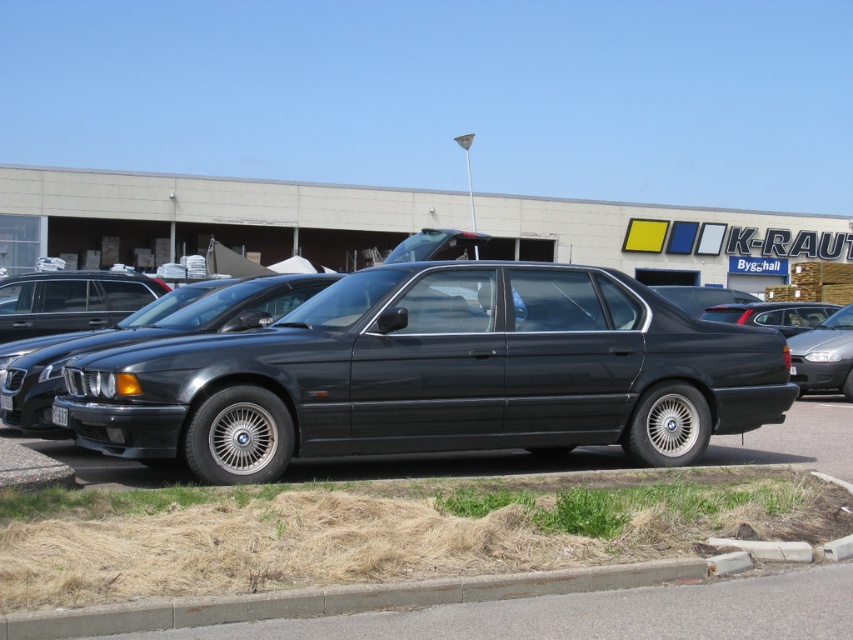
Question: Is gray concrete curb at lower center wider than white plastic license plate at center?

Choices:
 (A) yes
 (B) no

Answer: (A)

Question: Among these points, which one is farthest from the camera?

Choices:
 (A) (735, 312)
 (B) (61, 408)
 (C) (35, 561)

Answer: (A)

Question: Where is glossy black sedan at center located in relation to gray concrete curb at lower center in the image?

Choices:
 (A) above
 (B) below

Answer: (A)

Question: Can you confirm if matte black car at right is smaller than white plastic license plate at center?

Choices:
 (A) no
 (B) yes

Answer: (A)

Question: Which point is farther to the camera?

Choices:
 (A) (483, 596)
 (B) (62, 419)
 (C) (97, 380)

Answer: (B)

Question: Among these points, which one is nearest to the camera?

Choices:
 (A) (263, 328)
 (B) (51, 410)
 (C) (827, 305)

Answer: (B)